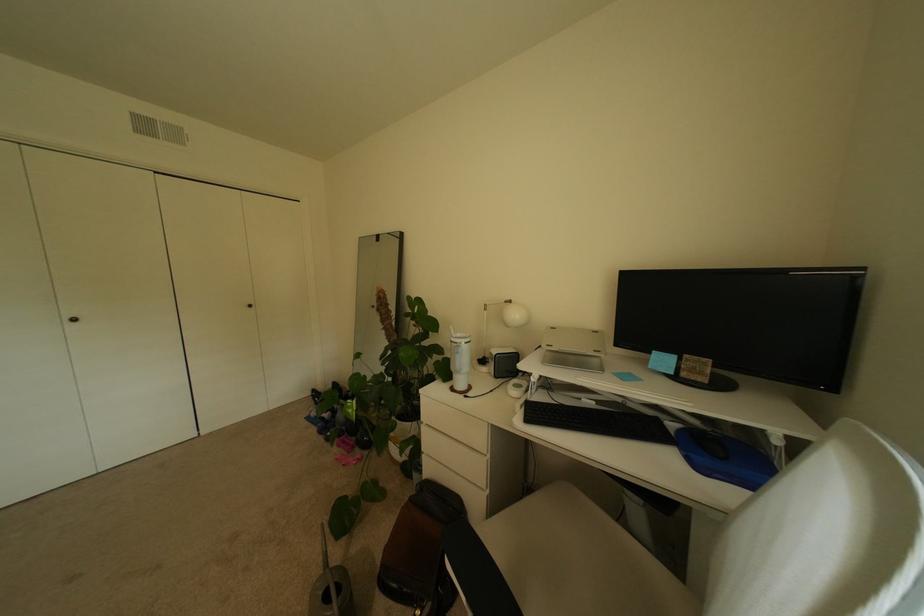
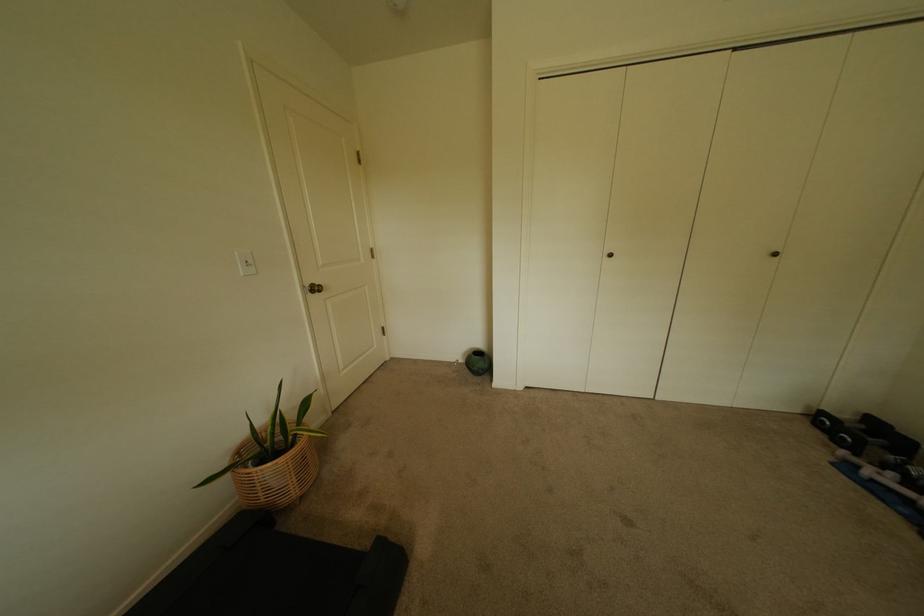
Find the pixel in the second image that matches [322,392] in the first image.

(831, 415)